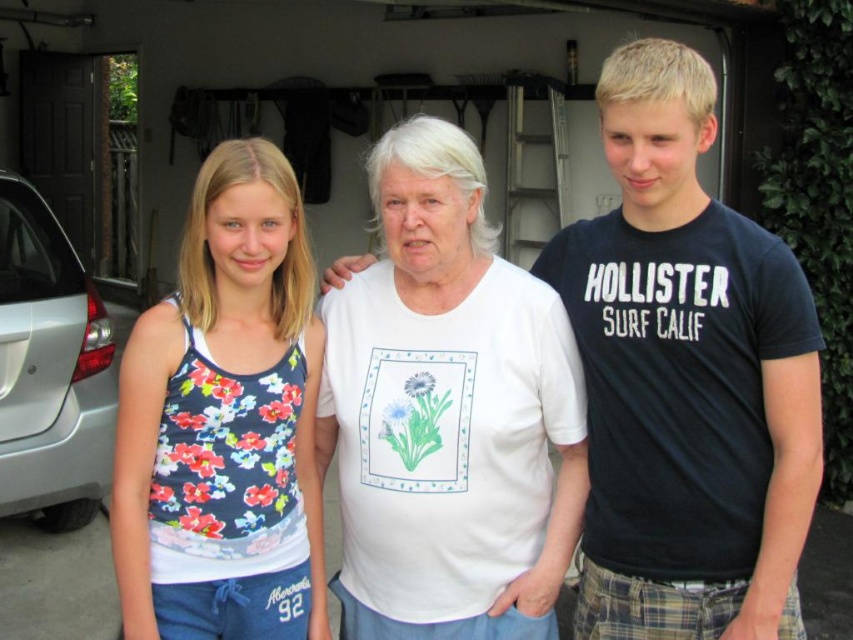
Question: Where is white cotton t-shirt at center located in relation to floral-patterned tank top at left in the image?

Choices:
 (A) above
 (B) below

Answer: (A)

Question: Which point is closer to the camera?

Choices:
 (A) (405, 422)
 (B) (99, 336)
 (C) (666, 428)
 (D) (258, 582)

Answer: (C)

Question: Among these points, which one is farthest from the camera?

Choices:
 (A) (160, 470)
 (B) (515, 536)
 (C) (36, 291)
 (D) (788, 604)

Answer: (C)

Question: Can you confirm if black cotton t-shirt at right is positioned above white cotton t-shirt at center?

Choices:
 (A) no
 (B) yes

Answer: (B)

Question: Which point appears farthest from the camera in this image?

Choices:
 (A) (167, 476)
 (B) (32, 449)
 (C) (373, 408)

Answer: (B)

Question: Does black cotton t-shirt at right have a greater width compared to silver metallic car at left?

Choices:
 (A) no
 (B) yes

Answer: (A)